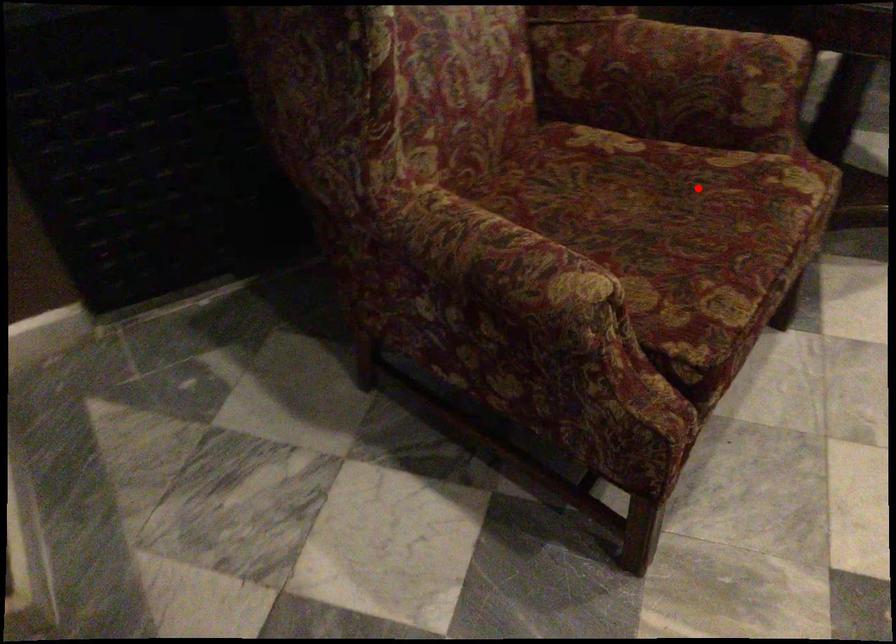
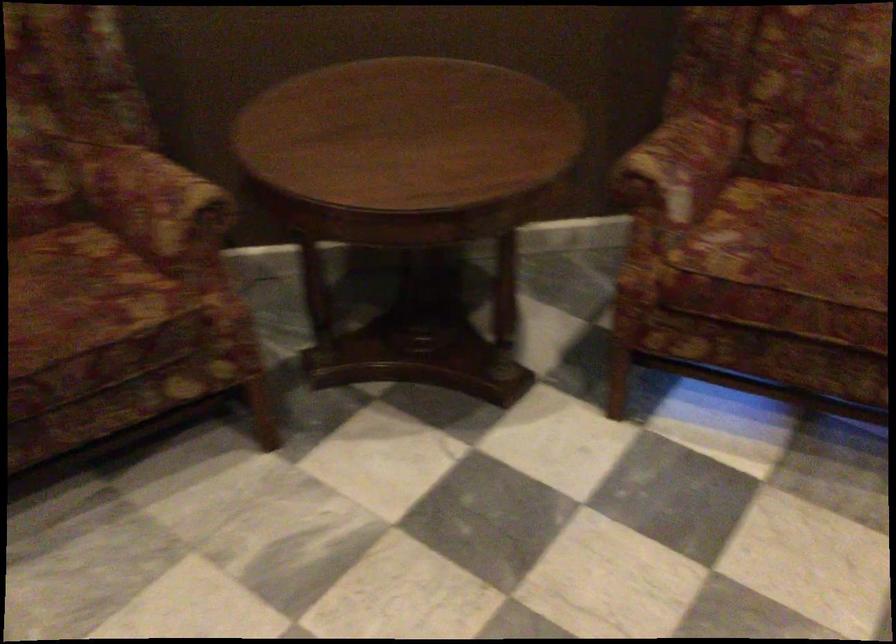
Question: I am providing you with two images of the same scene from different viewpoints. In image1, a red point is highlighted. Considering the same 3D point in image2, which of the following is correct?

Choices:
 (A) It is closer
 (B) It is farther

Answer: (B)